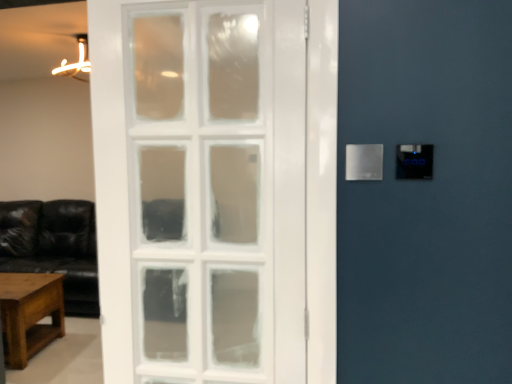
Question: Would you say satin silver panel at right is a long distance from wooden coffee table at lower left?

Choices:
 (A) no
 (B) yes

Answer: (B)

Question: From a real-world perspective, is satin silver panel at right located higher than wooden coffee table at lower left?

Choices:
 (A) no
 (B) yes

Answer: (B)

Question: Considering the relative sizes of satin silver panel at right and wooden coffee table at lower left in the image provided, is satin silver panel at right shorter than wooden coffee table at lower left?

Choices:
 (A) no
 (B) yes

Answer: (B)

Question: Does satin silver panel at right have a smaller size compared to wooden coffee table at lower left?

Choices:
 (A) yes
 (B) no

Answer: (A)

Question: Is satin silver panel at right outside wooden coffee table at lower left?

Choices:
 (A) yes
 (B) no

Answer: (A)

Question: From the image's perspective, is satin silver panel at right beneath wooden coffee table at lower left?

Choices:
 (A) no
 (B) yes

Answer: (A)

Question: Does wooden coffee table at lower left lie in front of satin silver panel at right?

Choices:
 (A) yes
 (B) no

Answer: (B)

Question: Is wooden coffee table at lower left aimed at satin silver panel at right?

Choices:
 (A) no
 (B) yes

Answer: (A)

Question: Is the position of wooden coffee table at lower left more distant than that of satin silver panel at right?

Choices:
 (A) yes
 (B) no

Answer: (A)

Question: Does wooden coffee table at lower left have a lesser width compared to satin silver panel at right?

Choices:
 (A) yes
 (B) no

Answer: (B)

Question: Can you confirm if wooden coffee table at lower left is positioned to the right of satin silver panel at right?

Choices:
 (A) no
 (B) yes

Answer: (A)

Question: Is wooden coffee table at lower left far from satin silver panel at right?

Choices:
 (A) no
 (B) yes

Answer: (B)

Question: Is point (2, 286) closer or farther from the camera than point (381, 162)?

Choices:
 (A) closer
 (B) farther

Answer: (B)